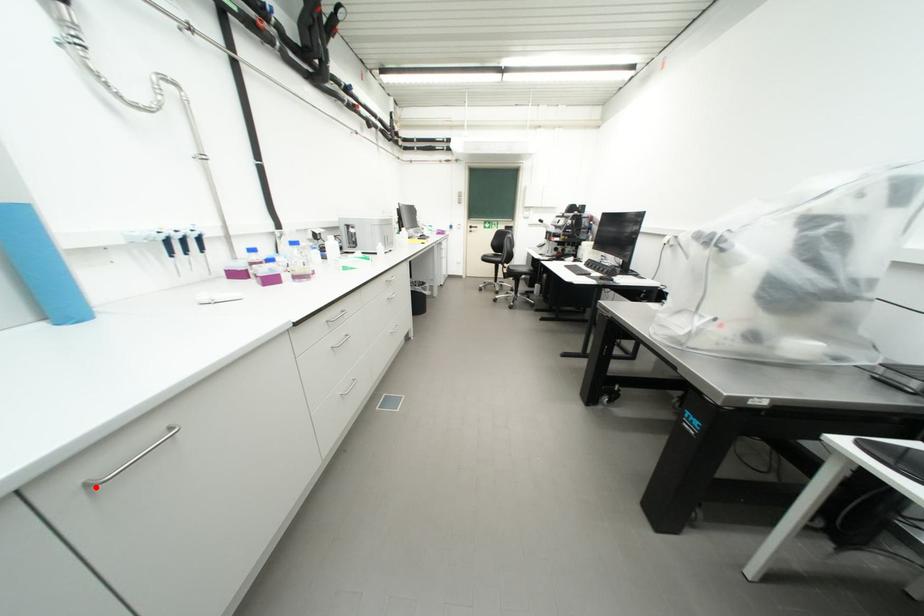
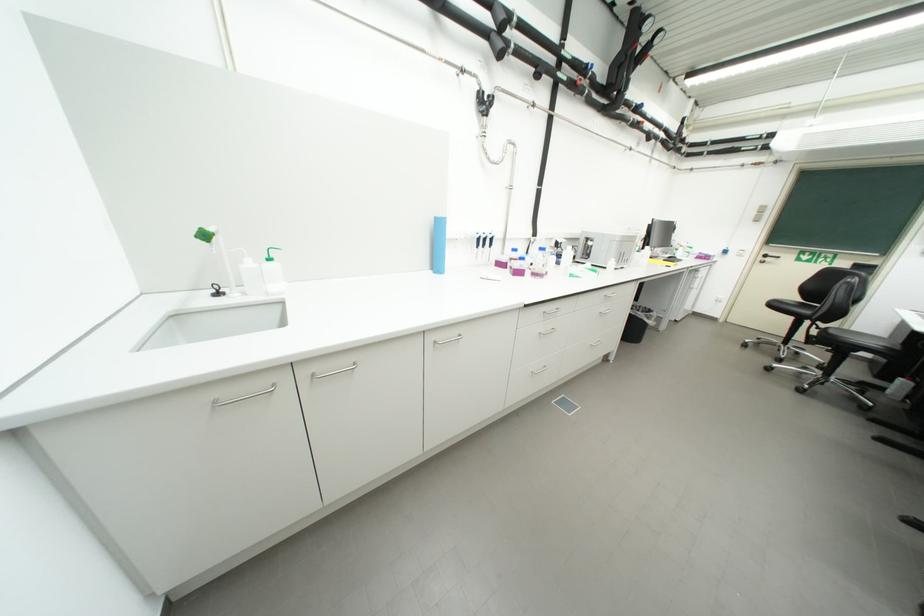
Locate, in the second image, the point that corresponds to the highlighted location in the first image.

(443, 344)